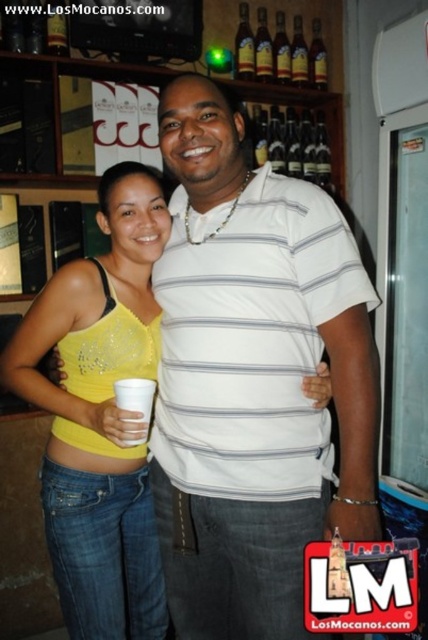
In the scene shown: You are a photographer taking a picture of the scene. You notice the white striped shirt at center and the yellow sequined tank top at center. Which one should you focus on if you want to capture the closer object?

The white striped shirt at center is closer to the viewer than the yellow sequined tank top at center, so you should focus on the white striped shirt at center to capture the closer object.

You are a bartender who needs to place a 10 inch wide tray between the white striped shirt at center and the yellow sequined tank top at center. Can you fit the tray between them without it overlapping either clothing item?

The distance between the white striped shirt at center and the yellow sequined tank top at center is 9.13 inches, which is less than the 10 inch width of the tray. Therefore, the tray cannot fit between them without overlapping.

You are standing in a bar and want to grab a drink from the shelf behind you. The point where you need to reach is located at coordinates point [142,381]. Given that your arm can extend up to 1 meter, can you reach that point?

The point [142,381] is 1.17 meters away from you, so your arm cannot reach it since it can only extend up to 1 meter.